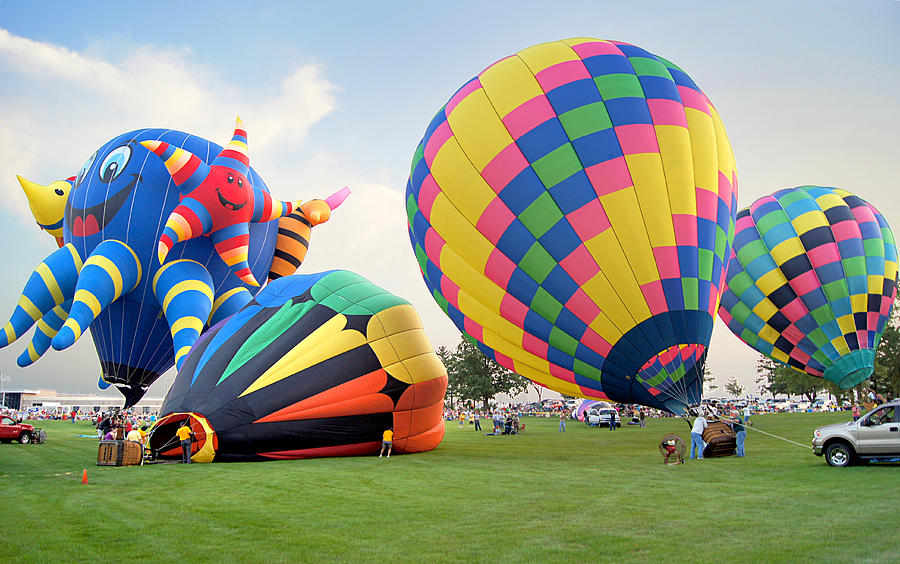
I want to click on chair, so pyautogui.click(x=667, y=446).